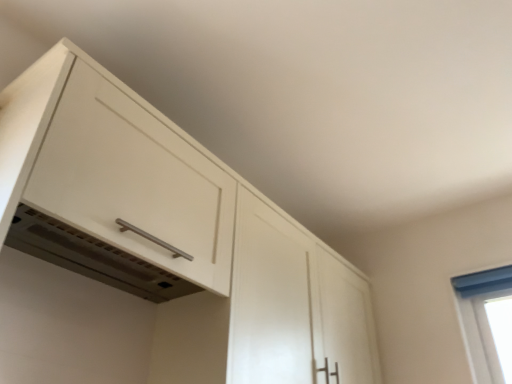
Image resolution: width=512 pixels, height=384 pixels. Describe the element at coordinates (181, 232) in the screenshot. I see `white glossy cabinet at upper left` at that location.

Find the location of a particular element. Image resolution: width=512 pixels, height=384 pixels. white glossy cabinet at upper left is located at coordinates (181, 232).

The height and width of the screenshot is (384, 512). In order to click on white glossy cabinet at upper left in this screenshot , I will do `click(181, 232)`.